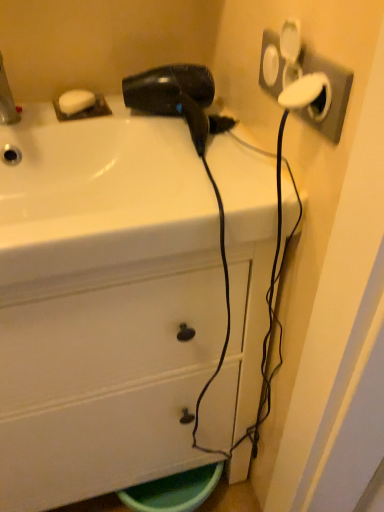
Locate an element on the screen. This screenshot has height=512, width=384. free location in front of black matte hair dryer at upper center is located at coordinates (205, 184).